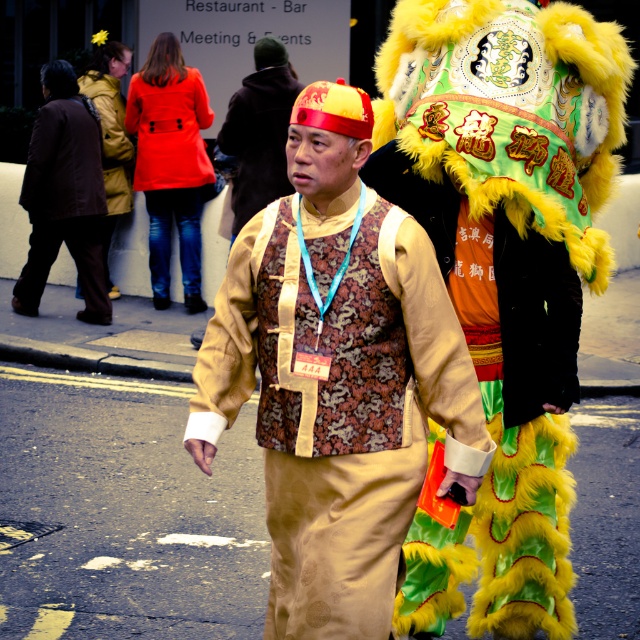
Question: Which point appears closest to the camera in this image?

Choices:
 (A) (620, 122)
 (B) (168, 141)

Answer: (A)

Question: Is yellow furry headdress at upper right positioned behind brown fabric jacket at left?

Choices:
 (A) no
 (B) yes

Answer: (A)

Question: Where is matte red coat at upper left located in relation to gold brocade vest at center in the image?

Choices:
 (A) below
 (B) above

Answer: (A)

Question: Can you confirm if yellow furry headdress at upper right is positioned below matte red coat at upper left?

Choices:
 (A) no
 (B) yes

Answer: (B)

Question: Estimate the real-world distances between objects in this image. Which object is closer to the brown fabric jacket at left?

Choices:
 (A) matte brown vest at center
 (B) matte red coat at upper left
 (C) gold brocade vest at center
 (D) yellow furry headdress at upper right

Answer: (B)

Question: Based on their relative distances, which object is nearer to the brown fabric jacket at left?

Choices:
 (A) yellow furry headdress at upper right
 (B) gold brocade vest at center
 (C) matte red coat at upper left
 (D) matte brown vest at center

Answer: (C)